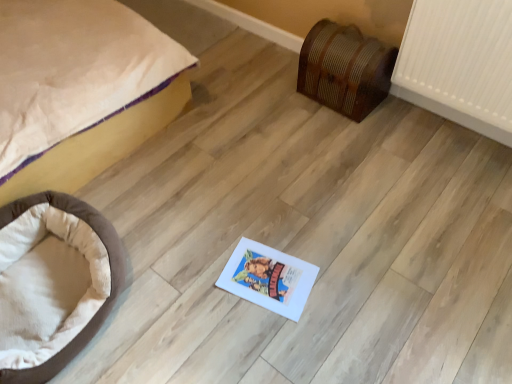
What do you see at coordinates (80, 90) in the screenshot?
I see `beige fabric bed at left` at bounding box center [80, 90].

In order to click on wooden chest at right in this screenshot , I will do `click(345, 69)`.

From the picture: Is brown plush dog bed at lower left spatially inside wooden chest at right, or outside of it?

The correct answer is: outside.

Between brown plush dog bed at lower left and wooden chest at right, which one has larger width?

With larger width is brown plush dog bed at lower left.

From a real-world perspective, is brown plush dog bed at lower left below wooden chest at right?

Yes, from a real-world perspective, brown plush dog bed at lower left is below wooden chest at right.

Is beige fabric bed at left positioned beyond the bounds of brown plush dog bed at lower left?

That's correct, beige fabric bed at left is outside of brown plush dog bed at lower left.

Where is `bed that appears on the left of brown plush dog bed at lower left`? bed that appears on the left of brown plush dog bed at lower left is located at coordinates (80, 90).

Based on the photo, is beige fabric bed at left far away from brown plush dog bed at lower left?

That's not correct — beige fabric bed at left is a little close to brown plush dog bed at lower left.

From the picture: Does wooden chest at right contain beige fabric bed at left?

Definitely not — beige fabric bed at left is not inside wooden chest at right.

From the image's perspective, is wooden chest at right on beige fabric bed at left?

No, from the image's perspective, wooden chest at right is not over beige fabric bed at left.

Is beige fabric bed at left at the back of brown plush dog bed at lower left?

Yes.

From the picture: Is brown plush dog bed at lower left at the right side of beige fabric bed at left?

Yes, brown plush dog bed at lower left is to the right of beige fabric bed at left.

Is brown plush dog bed at lower left far away from beige fabric bed at left?

brown plush dog bed at lower left is near beige fabric bed at left, not far away.

In the image, is brown plush dog bed at lower left positioned in front of or behind beige fabric bed at left?

brown plush dog bed at lower left is behind beige fabric bed at left.

How many degrees apart are the facing directions of wooden chest at right and brown plush dog bed at lower left?

wooden chest at right and brown plush dog bed at lower left are facing 89.9 degrees away from each other.

Is wooden chest at right wider or thinner than brown plush dog bed at lower left?

wooden chest at right is thinner than brown plush dog bed at lower left.

Based on the photo, relative to brown plush dog bed at lower left, is wooden chest at right in front or behind?

wooden chest at right is positioned farther from the viewer than brown plush dog bed at lower left.

From a real-world perspective, does beige fabric bed at left stand above wooden chest at right?

Yes.

Based on the photo, which is behind, beige fabric bed at left or wooden chest at right?

wooden chest at right is further away from the camera.

Does beige fabric bed at left have a smaller size compared to wooden chest at right?

Incorrect, beige fabric bed at left is not smaller in size than wooden chest at right.

From the image's perspective, is beige fabric bed at left above wooden chest at right?

Yes, from the image's perspective, beige fabric bed at left is above wooden chest at right.

The width and height of the screenshot is (512, 384). Find the location of `furniture located behind the brown plush dog bed at lower left`. furniture located behind the brown plush dog bed at lower left is located at coordinates (345, 69).

This screenshot has height=384, width=512. Identify the location of bed that appears in front of the brown plush dog bed at lower left. (80, 90).

Looking at the image, which one is located further to brown plush dog bed at lower left, wooden chest at right or beige fabric bed at left?

wooden chest at right.

Based on their spatial positions, is beige fabric bed at left or wooden chest at right closer to brown plush dog bed at lower left?

Based on the image, beige fabric bed at left appears to be nearer to brown plush dog bed at lower left.

Looking at the image, which one is located further to wooden chest at right, brown plush dog bed at lower left or beige fabric bed at left?

brown plush dog bed at lower left is further to wooden chest at right.

Considering their positions, is wooden chest at right positioned further to beige fabric bed at left than brown plush dog bed at lower left?

wooden chest at right is further to beige fabric bed at left.

Estimate the real-world distances between objects in this image. Which object is closer to wooden chest at right, beige fabric bed at left or brown plush dog bed at lower left?

beige fabric bed at left.

Looking at this image, when comparing their distances from beige fabric bed at left, does brown plush dog bed at lower left or wooden chest at right seem closer?

Among the two, brown plush dog bed at lower left is located nearer to beige fabric bed at left.

This screenshot has height=384, width=512. Find the location of `dog bed situated between beige fabric bed at left and wooden chest at right from left to right`. dog bed situated between beige fabric bed at left and wooden chest at right from left to right is located at coordinates (111, 277).